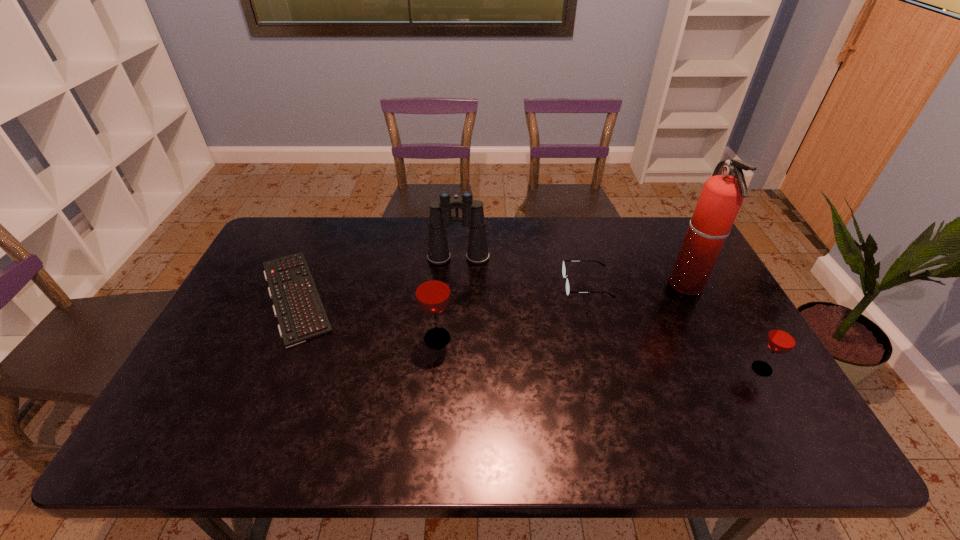
Where is `binoculars`? The height and width of the screenshot is (540, 960). binoculars is located at coordinates (440, 218).

I want to click on vacant space located 0.050m on the left of the farther glass, so click(x=402, y=339).

Identify the location of vacant space located 0.180m on the left of the nearest object. This screenshot has height=540, width=960. (680, 369).

Locate an element on the screen. This screenshot has height=540, width=960. vacant space located with the nozzle and gauge on the tallest object is located at coordinates (640, 285).

Where is `vacant space located 0.320m with the nozzle and gauge on the tallest object`? vacant space located 0.320m with the nozzle and gauge on the tallest object is located at coordinates (565, 285).

The width and height of the screenshot is (960, 540). What are the coordinates of `vacant space situated 0.310m with the nozzle and gauge on the tallest object` in the screenshot? It's located at (568, 285).

Where is `free spot located on the lenses of the third object from right to left`? The height and width of the screenshot is (540, 960). free spot located on the lenses of the third object from right to left is located at coordinates (502, 284).

Where is `free space located 0.230m on the lenses of the third object from right to left`? free space located 0.230m on the lenses of the third object from right to left is located at coordinates (489, 284).

The width and height of the screenshot is (960, 540). What are the coordinates of `vacant space located 0.320m on the lenses of the third object from right to left` in the screenshot? It's located at (460, 284).

This screenshot has width=960, height=540. I want to click on vacant point located on the front of the shortest object, so click(246, 409).